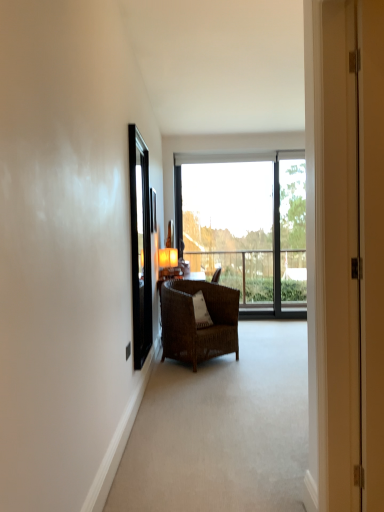
Question: Considering their positions, is transparent glass window at center located in front of or behind matte orange lampshade at center?

Choices:
 (A) front
 (B) behind

Answer: (B)

Question: From the image's perspective, is transparent glass window at center above or below matte orange lampshade at center?

Choices:
 (A) above
 (B) below

Answer: (A)

Question: Which object is positioned farthest from the matte white door at center?

Choices:
 (A) matte orange lampshade at center
 (B) transparent glass window at center
 (C) black glossy screen door at left
 (D) brown wicker chair at center

Answer: (B)

Question: Estimate the real-world distances between objects in this image. Which object is farther from the transparent glass window at center?

Choices:
 (A) black glossy screen door at left
 (B) matte white door at center
 (C) matte orange lampshade at center
 (D) brown wicker chair at center

Answer: (B)